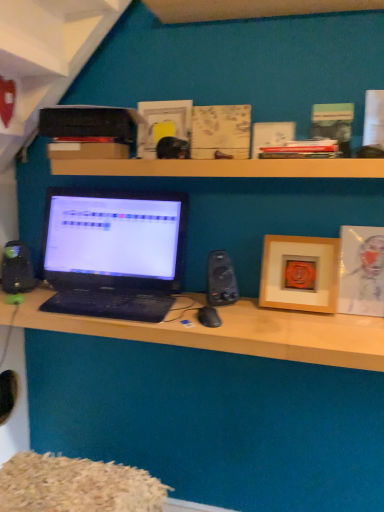
This screenshot has height=512, width=384. Identify the location of empty space that is to the right of black plastic speaker at center-right, which is the 1th speaker in right-to-left order. (271, 317).